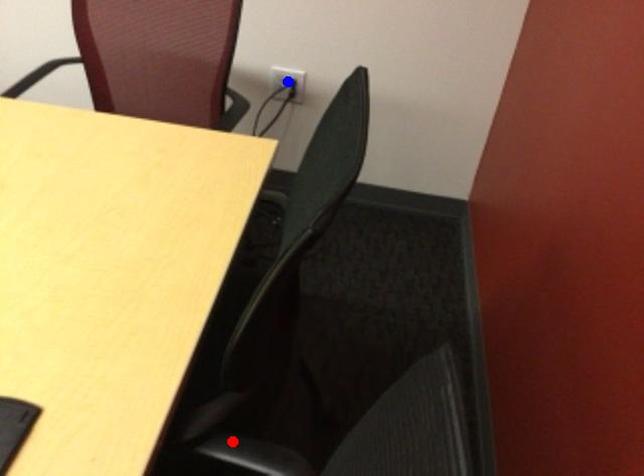
Order these from nearest to farthest:
A) yellow point
B) blue point
C) red point

1. red point
2. yellow point
3. blue point